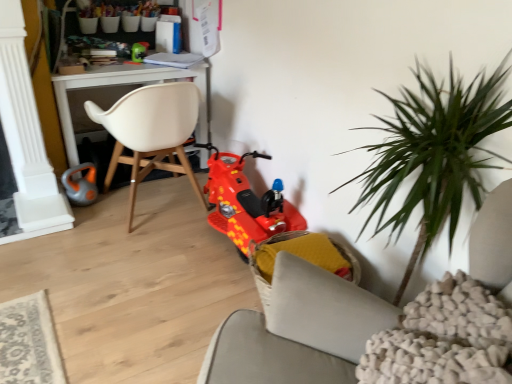
The image size is (512, 384). I want to click on yellow fabric chair at lower center, the 1th chair from the right, so click(x=298, y=330).

The image size is (512, 384). Describe the element at coordinates (245, 203) in the screenshot. I see `shiny plastic scooter at center, the first toy from the bottom` at that location.

At what (x,y) coordinates should I click in order to perform the action: click on white matte chair at center, marked as the 1th chair in a left-to-right arrangement. Please return your answer as a coordinate pair (x, y). Looking at the image, I should click on (151, 133).

Describe the element at coordinates (139, 51) in the screenshot. The width and height of the screenshot is (512, 384). I see `green plastic toy at upper center, the third toy when ordered from bottom to top` at that location.

Find the location of a particular element. The width and height of the screenshot is (512, 384). white plastic desk at upper left is located at coordinates (128, 85).

This screenshot has width=512, height=384. What are the coordinates of `yellow fabric chair at lower center, which appears as the 1th chair when ordered from the bottom` in the screenshot? It's located at (298, 330).

Which of these two, orange rubber toy at lower left, placed as the 2th toy when sorted from top to bottom, or white plastic desk at upper left, is bigger?

white plastic desk at upper left.

Which is less distant, (x=64, y=175) or (x=102, y=75)?

The point (x=102, y=75) is closer.

I want to click on toy that is the 1st object located behind the white plastic desk at upper left, so pos(81,185).

Are orange rubber toy at lower left, placed as the 2th toy when sorted from top to bottom, and white plastic desk at upper left located far from each other?

No, there isn't a large distance between orange rubber toy at lower left, placed as the 2th toy when sorted from top to bottom, and white plastic desk at upper left.

From the image's perspective, would you say green plastic toy at upper center, the 1th toy when ordered from top to bottom, is shown under orange rubber toy at lower left, placed as the 2th toy when sorted from top to bottom?

Incorrect, from the image's perspective, green plastic toy at upper center, the 1th toy when ordered from top to bottom, is higher than orange rubber toy at lower left, placed as the 2th toy when sorted from top to bottom.

In terms of height, does green plastic toy at upper center, the second toy positioned from the left, look taller or shorter compared to orange rubber toy at lower left, which appears as the third toy when viewed from the right?

Clearly, green plastic toy at upper center, the second toy positioned from the left, is shorter compared to orange rubber toy at lower left, which appears as the third toy when viewed from the right.

Is green plastic toy at upper center, the second toy positioned from the left, next to orange rubber toy at lower left, arranged as the first toy when viewed from the left, and touching it?

No, green plastic toy at upper center, the second toy positioned from the left, is not beside orange rubber toy at lower left, arranged as the first toy when viewed from the left.

From a real-world perspective, is green plastic toy at upper center, the 2th toy in the right-to-left sequence, positioned above or below orange rubber toy at lower left, placed as the 2th toy when sorted from top to bottom?

From a real-world perspective, green plastic toy at upper center, the 2th toy in the right-to-left sequence, is physically above orange rubber toy at lower left, placed as the 2th toy when sorted from top to bottom.

Is white matte chair at center, which is the 2th chair from right to left, positioned beyond the bounds of shiny plastic scooter at center, the first toy from the bottom?

Indeed, white matte chair at center, which is the 2th chair from right to left, is completely outside shiny plastic scooter at center, the first toy from the bottom.

Which point is more distant from viewer, (x=151, y=119) or (x=228, y=177)?

The point (x=228, y=177) is farther from the camera.

From the image's perspective, does white matte chair at center, which is the 2th chair from right to left, appear higher than shiny plastic scooter at center, the first toy from the bottom?

Indeed, from the image's perspective, white matte chair at center, which is the 2th chair from right to left, is shown above shiny plastic scooter at center, the first toy from the bottom.

Considering the sizes of objects white matte chair at center, which is the 2th chair from right to left, and shiny plastic scooter at center, the first toy from the bottom, in the image provided, who is thinner, white matte chair at center, which is the 2th chair from right to left, or shiny plastic scooter at center, the first toy from the bottom,?

shiny plastic scooter at center, the first toy from the bottom, is thinner.

Considering the positions of objects white matte chair at center, marked as the 1th chair in a left-to-right arrangement, and orange rubber toy at lower left, which appears as the 2th toy when ordered from the bottom, in the image provided, who is more to the left, white matte chair at center, marked as the 1th chair in a left-to-right arrangement, or orange rubber toy at lower left, which appears as the 2th toy when ordered from the bottom,?

Positioned to the left is orange rubber toy at lower left, which appears as the 2th toy when ordered from the bottom.

Which of these two, white matte chair at center, arranged as the 2th chair when ordered from the bottom, or orange rubber toy at lower left, arranged as the first toy when viewed from the left, stands taller?

white matte chair at center, arranged as the 2th chair when ordered from the bottom, is taller.

At what (x,y) coordinates should I click in order to perform the action: click on chair above the orange rubber toy at lower left, which appears as the third toy when viewed from the right (from the image's perspective). Please return your answer as a coordinate pair (x, y). The image size is (512, 384). Looking at the image, I should click on (151, 133).

Can you confirm if white matte chair at center, which is the 2th chair from right to left, is smaller than orange rubber toy at lower left, which appears as the 2th toy when ordered from the bottom?

No, white matte chair at center, which is the 2th chair from right to left, is not smaller than orange rubber toy at lower left, which appears as the 2th toy when ordered from the bottom.

Which is more to the right, green plastic toy at upper center, the second toy positioned from the left, or white matte chair at center, arranged as the 2th chair when ordered from the bottom?

white matte chair at center, arranged as the 2th chair when ordered from the bottom, is more to the right.

Which is in front, green plastic toy at upper center, the 1th toy when ordered from top to bottom, or white matte chair at center, the 1th chair when ordered from top to bottom?

white matte chair at center, the 1th chair when ordered from top to bottom, is more forward.

Which object is wider, green plastic toy at upper center, the third toy when ordered from bottom to top, or white matte chair at center, which is the 2th chair from right to left?

Wider between the two is white matte chair at center, which is the 2th chair from right to left.

From a real-world perspective, which object rests below the other?

In real-world perspective, white matte chair at center, marked as the 1th chair in a left-to-right arrangement, is lower.

Is shiny plastic scooter at center, the first toy from the bottom, looking in the opposite direction of white matte chair at center, marked as the 1th chair in a left-to-right arrangement?

No, shiny plastic scooter at center, the first toy from the bottom, is not facing away from white matte chair at center, marked as the 1th chair in a left-to-right arrangement.

From a real-world perspective, which object rests below the other?

shiny plastic scooter at center, the first toy from the bottom, from a real-world perspective.

Looking at their sizes, would you say shiny plastic scooter at center, which appears as the 3th toy when viewed from the top, is wider or thinner than white matte chair at center, arranged as the 2th chair when ordered from the bottom?

Considering their sizes, shiny plastic scooter at center, which appears as the 3th toy when viewed from the top, looks slimmer than white matte chair at center, arranged as the 2th chair when ordered from the bottom.

From a real-world perspective, who is located higher, orange rubber toy at lower left, placed as the 2th toy when sorted from top to bottom, or white matte chair at center, marked as the 1th chair in a left-to-right arrangement?

From a 3D spatial view, white matte chair at center, marked as the 1th chair in a left-to-right arrangement, is above.

What's the angular difference between orange rubber toy at lower left, which appears as the third toy when viewed from the right, and white matte chair at center, arranged as the 2th chair when ordered from the bottom,'s facing directions?

169 degrees separate the facing orientations of orange rubber toy at lower left, which appears as the third toy when viewed from the right, and white matte chair at center, arranged as the 2th chair when ordered from the bottom.

Between orange rubber toy at lower left, arranged as the first toy when viewed from the left, and white matte chair at center, which is the 2th chair from right to left, which one appears on the left side from the viewer's perspective?

orange rubber toy at lower left, arranged as the first toy when viewed from the left.

From the image's perspective, starting from the white matte chair at center, the 1th chair when ordered from top to bottom, which toy is the 1st one below? Please provide its 2D coordinates.

[(81, 185)]

The height and width of the screenshot is (384, 512). In order to click on toy to the left of white plastic desk at upper left in this screenshot , I will do `click(81, 185)`.

At what (x,y) coordinates should I click in order to perform the action: click on toy above the orange rubber toy at lower left, arranged as the first toy when viewed from the left (from the image's perspective). Please return your answer as a coordinate pair (x, y). This screenshot has height=384, width=512. Looking at the image, I should click on (139, 51).

Estimate the real-world distances between objects in this image. Which object is further from white matte chair at center, marked as the 1th chair in a left-to-right arrangement, shiny plastic scooter at center, placed as the first toy when sorted from right to left, or green plastic toy at upper center, the second toy positioned from the left?

The object further to white matte chair at center, marked as the 1th chair in a left-to-right arrangement, is green plastic toy at upper center, the second toy positioned from the left.

Consider the image. Based on their spatial positions, is shiny plastic scooter at center, which appears as the 3th toy when viewed from the left, or green plastic toy at upper center, the 2th toy in the right-to-left sequence, further from yellow fabric chair at lower center, the 1th chair from the right?

Among the two, green plastic toy at upper center, the 2th toy in the right-to-left sequence, is located further to yellow fabric chair at lower center, the 1th chair from the right.

Estimate the real-world distances between objects in this image. Which object is further from orange rubber toy at lower left, which appears as the 2th toy when ordered from the bottom, white matte chair at center, which is the 2th chair from right to left, or white plastic desk at upper left?

white matte chair at center, which is the 2th chair from right to left, lies further to orange rubber toy at lower left, which appears as the 2th toy when ordered from the bottom, than the other object.

When comparing their distances from yellow fabric chair at lower center, the 1th chair from the right, does white plastic desk at upper left or green plastic toy at upper center, the 1th toy when ordered from top to bottom, seem closer?

white plastic desk at upper left is closer to yellow fabric chair at lower center, the 1th chair from the right.

Considering their positions, is white plastic desk at upper left positioned closer to white matte chair at center, the 1th chair when ordered from top to bottom, than yellow fabric chair at lower center, which appears as the 1th chair when ordered from the bottom?

white plastic desk at upper left lies closer to white matte chair at center, the 1th chair when ordered from top to bottom, than the other object.

Based on their spatial positions, is shiny plastic scooter at center, placed as the first toy when sorted from right to left, or yellow fabric chair at lower center, acting as the second chair starting from the left, closer to green plastic toy at upper center, the 2th toy in the right-to-left sequence?

shiny plastic scooter at center, placed as the first toy when sorted from right to left, lies closer to green plastic toy at upper center, the 2th toy in the right-to-left sequence, than the other object.

Based on their spatial positions, is orange rubber toy at lower left, arranged as the first toy when viewed from the left, or white matte chair at center, the 1th chair when ordered from top to bottom, further from white plastic desk at upper left?

orange rubber toy at lower left, arranged as the first toy when viewed from the left, is positioned further to the anchor white plastic desk at upper left.

When comparing their distances from orange rubber toy at lower left, which appears as the 2th toy when ordered from the bottom, does white plastic desk at upper left or yellow fabric chair at lower center, the 1th chair from the right, seem closer?

The object closer to orange rubber toy at lower left, which appears as the 2th toy when ordered from the bottom, is white plastic desk at upper left.

This screenshot has width=512, height=384. What are the coordinates of `table between white matte chair at center, marked as the 1th chair in a left-to-right arrangement, and green plastic toy at upper center, the third toy when ordered from bottom to top, from front to back` in the screenshot? It's located at (128, 85).

You are a GUI agent. You are given a task and a screenshot of the screen. Output one action in this format:
    pyautogui.click(x=<x>, y=<y>)
    Task: Click on the table between orange rubber toy at lower left, which appears as the third toy when viewed from the right, and yellow fabric chair at lower center, acting as the second chair starting from the left
    Image resolution: width=512 pixels, height=384 pixels.
    Given the screenshot: What is the action you would take?
    pyautogui.click(x=128, y=85)

Where is `table between green plastic toy at upper center, the 1th toy when ordered from top to bottom, and yellow fabric chair at lower center, the 1th chair from the right, in the vertical direction`? table between green plastic toy at upper center, the 1th toy when ordered from top to bottom, and yellow fabric chair at lower center, the 1th chair from the right, in the vertical direction is located at coordinates (128, 85).

Find the location of a particular element. chair between orange rubber toy at lower left, which appears as the third toy when viewed from the right, and shiny plastic scooter at center, the first toy from the bottom is located at coordinates (x=151, y=133).